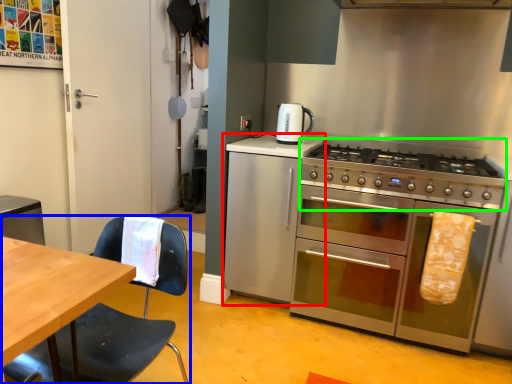
Question: Considering the real-world distances, which object is farthest from cabinetry (highlighted by a red box)? chair (highlighted by a blue box) or gas stove (highlighted by a green box)?

Choices:
 (A) chair
 (B) gas stove

Answer: (A)